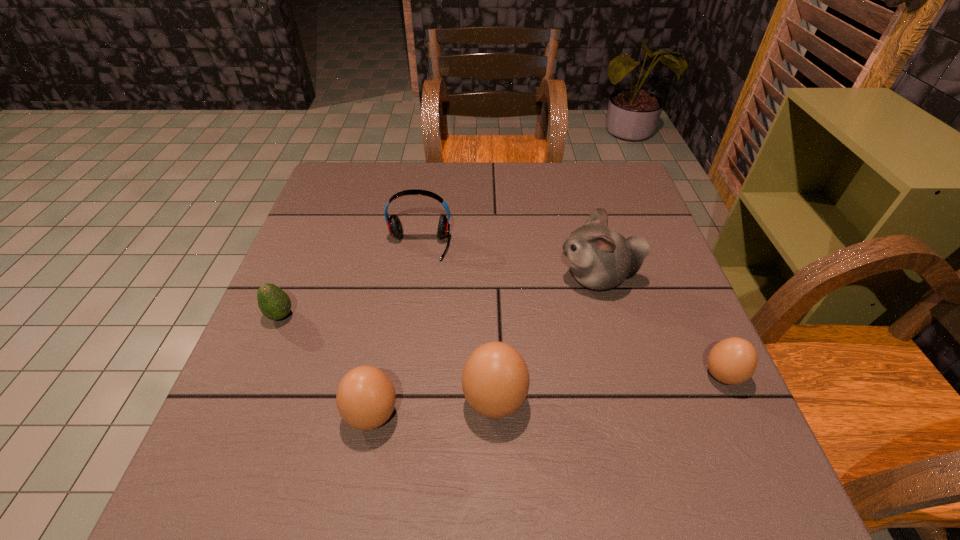
The height and width of the screenshot is (540, 960). Find the location of `object at the near right corner`. object at the near right corner is located at coordinates (732, 361).

The height and width of the screenshot is (540, 960). In the image, there is a desktop. In order to click on vacant space at the far edge in this screenshot , I will do `click(468, 176)`.

Locate an element on the screen. The height and width of the screenshot is (540, 960). free spot at the near edge of the desktop is located at coordinates (631, 415).

Where is `vacant space at the left edge`? This screenshot has width=960, height=540. vacant space at the left edge is located at coordinates (340, 268).

You are a GUI agent. You are given a task and a screenshot of the screen. Output one action in this format:
    pyautogui.click(x=<x>, y=<y>)
    Task: Click on the vacant space at the right edge
    
    Given the screenshot: What is the action you would take?
    pyautogui.click(x=641, y=347)

In the image, there is a desktop. What are the coordinates of `blank space at the far left corner` in the screenshot? It's located at (354, 170).

You are a GUI agent. You are given a task and a screenshot of the screen. Output one action in this format:
    pyautogui.click(x=<x>, y=<y>)
    Task: Click on the vacant space at the near right corner
    
    Given the screenshot: What is the action you would take?
    pyautogui.click(x=706, y=408)

Locate an element on the screen. The image size is (960, 540). free spot between the second boiled egg from right to left and the second shortest boiled egg is located at coordinates (433, 408).

Identify the location of vacant area between the second boiled egg from right to left and the leftmost object. Image resolution: width=960 pixels, height=540 pixels. (388, 359).

Identify the location of free point between the second boiled egg from left to right and the second shortest boiled egg. (433, 408).